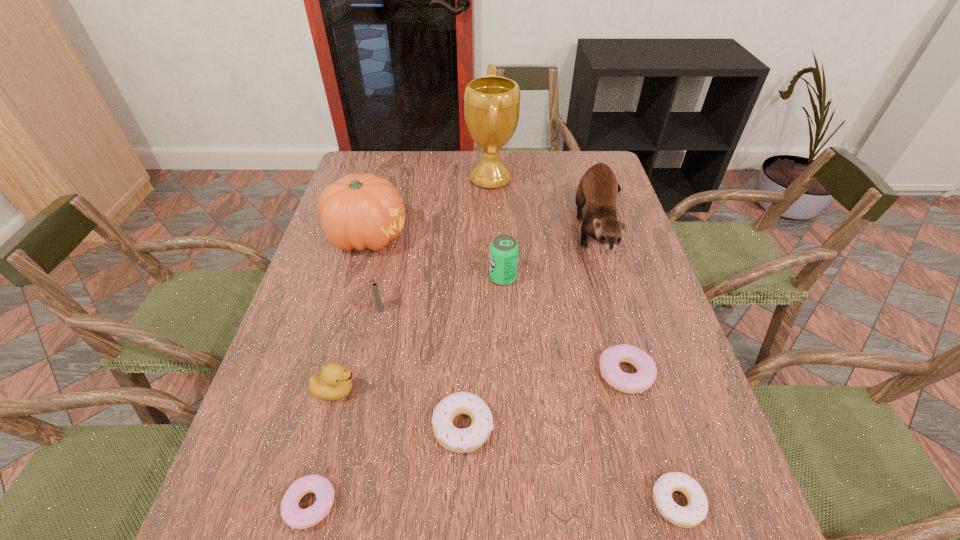
Locate an element on the screen. vacant point located between the brown ferret and the pumpkin is located at coordinates (486, 232).

The width and height of the screenshot is (960, 540). I want to click on vacant area that lies between the tallest object and the duckling, so (x=413, y=285).

This screenshot has width=960, height=540. Find the location of `free spot between the pop soda and the right white doughnut`. free spot between the pop soda and the right white doughnut is located at coordinates (590, 390).

At what (x,y) coordinates should I click in order to perform the action: click on empty space between the fifth farthest object and the pumpkin. Please return your answer as a coordinate pair (x, y). Looking at the image, I should click on (373, 273).

Identify the location of free space between the duckling and the igniter. (357, 349).

Find the location of a particular element. The image size is (960, 540). free space that is in between the bigger pink doughnut and the seventh shortest object is located at coordinates (564, 326).

The height and width of the screenshot is (540, 960). In order to click on unoccupied position between the smaller white doughnut and the left pink doughnut in this screenshot , I will do `click(493, 503)`.

Where is `vacant space that is in between the pumpkin and the duckling`? vacant space that is in between the pumpkin and the duckling is located at coordinates (351, 313).

Where is `free space that is in between the brown ferret and the duckling`? This screenshot has height=540, width=960. free space that is in between the brown ferret and the duckling is located at coordinates (469, 309).

Where is `unoccupied position between the tallest object and the smaller white doughnut`? The width and height of the screenshot is (960, 540). unoccupied position between the tallest object and the smaller white doughnut is located at coordinates point(584,341).